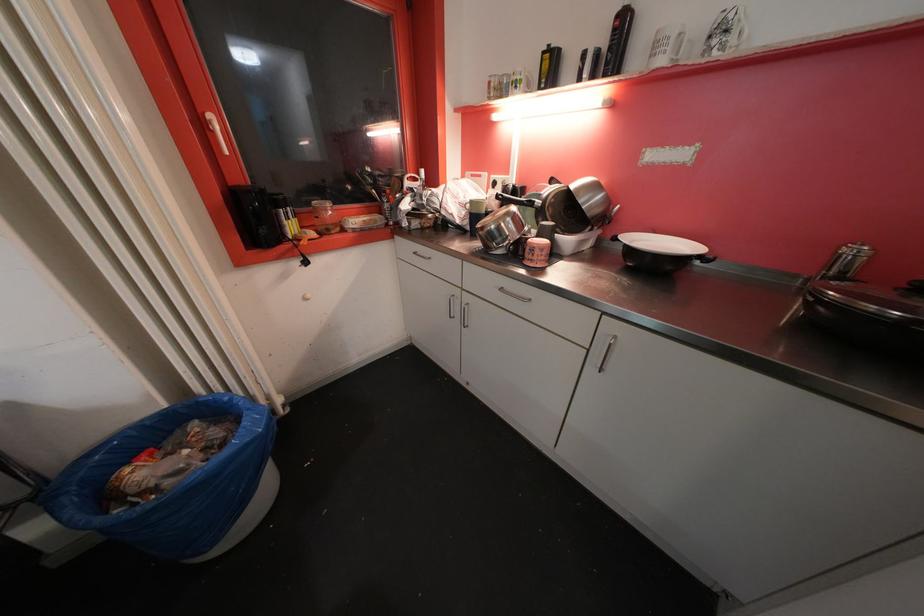
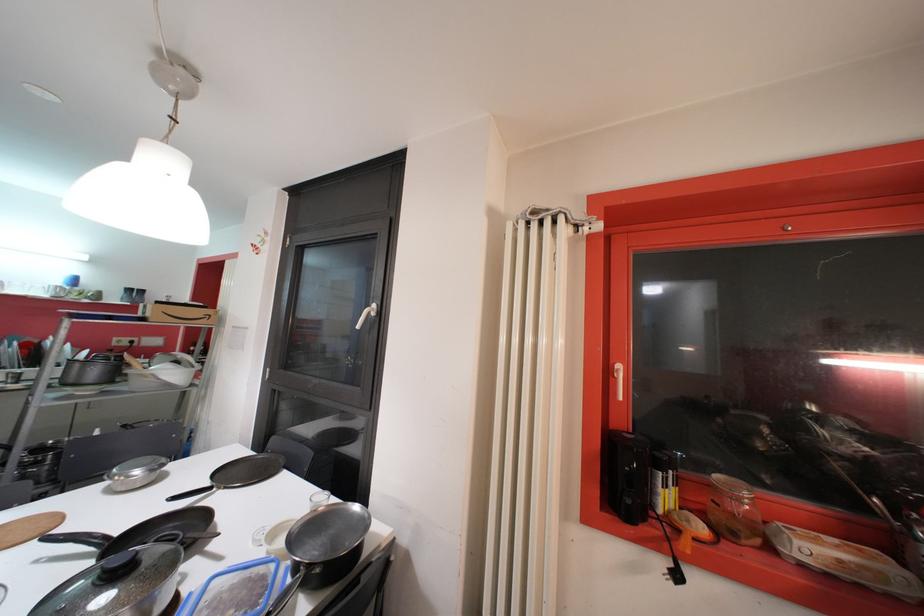
Where in the second image is the point corresponding to (333,233) from the first image?

(738, 536)